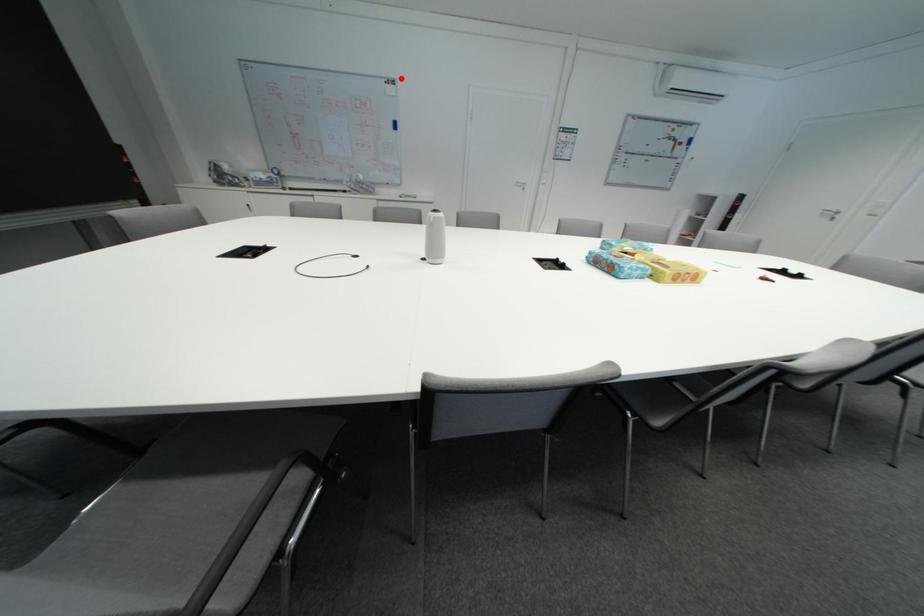
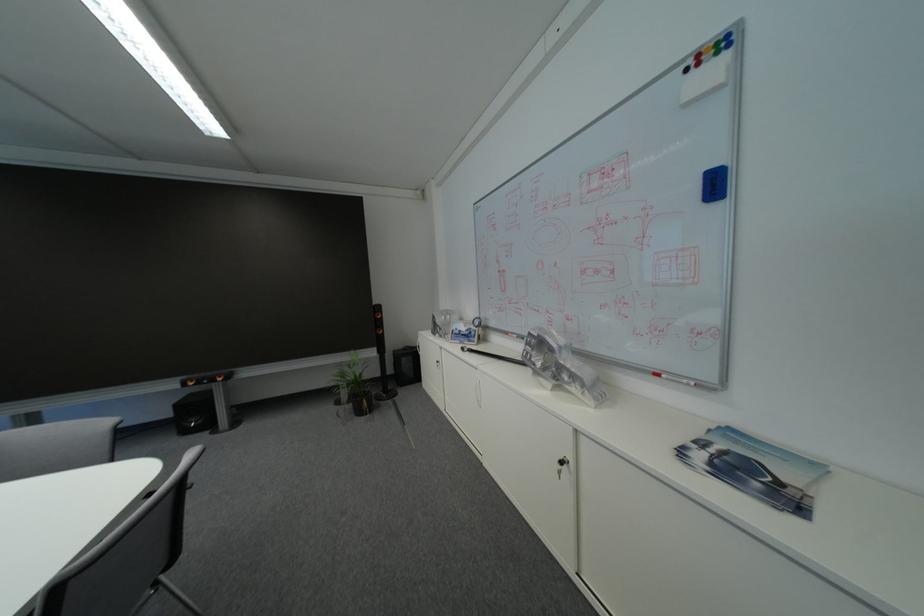
Question: I am providing you with two images of the same scene from different viewpoints. A red point is marked on the first image. Can you still see the location of the red point in image 2?

Choices:
 (A) Yes
 (B) No

Answer: (A)